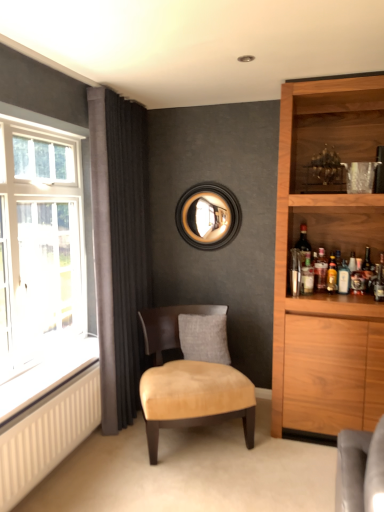
Question: Considering the relative sizes of suede-like beige chair at center and matte dark brown wine bottle at right in the image provided, is suede-like beige chair at center taller than matte dark brown wine bottle at right?

Choices:
 (A) yes
 (B) no

Answer: (A)

Question: Is suede-like beige chair at center behind matte dark brown wine bottle at right?

Choices:
 (A) no
 (B) yes

Answer: (A)

Question: Would you consider suede-like beige chair at center to be distant from matte dark brown wine bottle at right?

Choices:
 (A) no
 (B) yes

Answer: (B)

Question: From the image's perspective, is suede-like beige chair at center on top of matte dark brown wine bottle at right?

Choices:
 (A) no
 (B) yes

Answer: (A)

Question: Would you say matte dark brown wine bottle at right is part of suede-like beige chair at center's contents?

Choices:
 (A) no
 (B) yes

Answer: (A)

Question: From the image's perspective, relative to white textured radiator at lower left, is translucent glass bottle at right, which is the second bottle from right to left, above or below?

Choices:
 (A) above
 (B) below

Answer: (A)

Question: Is translucent glass bottle at right, which is the second bottle from right to left, to the left or to the right of white textured radiator at lower left in the image?

Choices:
 (A) right
 (B) left

Answer: (A)

Question: Is point (317, 273) positioned closer to the camera than point (74, 378)?

Choices:
 (A) closer
 (B) farther

Answer: (B)

Question: Based on their sizes in the image, would you say translucent glass bottle at right, positioned as the second bottle in left-to-right order, is bigger or smaller than white textured radiator at lower left?

Choices:
 (A) big
 (B) small

Answer: (B)

Question: From a real-world perspective, is suede-like beige chair at center physically located above or below shiny dark glass bottle at right, arranged as the 3th bottle when viewed from the left?

Choices:
 (A) above
 (B) below

Answer: (B)

Question: Based on their positions, is suede-like beige chair at center located to the left or right of shiny dark glass bottle at right, the 1th bottle positioned from the right?

Choices:
 (A) left
 (B) right

Answer: (A)

Question: Is point (145, 340) closer or farther from the camera than point (367, 256)?

Choices:
 (A) closer
 (B) farther

Answer: (B)

Question: From the image's perspective, is suede-like beige chair at center above or below shiny dark glass bottle at right, the 1th bottle positioned from the right?

Choices:
 (A) below
 (B) above

Answer: (A)

Question: From a real-world perspective, relative to dark grey velvet curtains at left, is shiny dark glass bottle at right, arranged as the 3th bottle when viewed from the left, vertically above or below?

Choices:
 (A) below
 (B) above

Answer: (A)

Question: Is shiny dark glass bottle at right, arranged as the 3th bottle when viewed from the left, taller or shorter than dark grey velvet curtains at left?

Choices:
 (A) short
 (B) tall

Answer: (A)